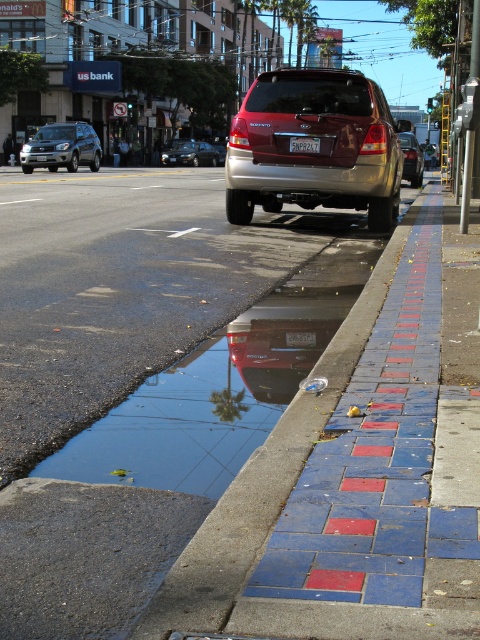
Consider the image. You are standing at the point marked by the coordinates point (191, 154). Looking towards the parked maroon Kia Sorento, which direction should you walk to reach it?

The metallic silver sedan at center is represented by point (191, 154). The parked maroon Kia Sorento is located along the curb in the foreground. To reach the parked maroon Kia Sorento from the point, you should walk towards the curb, which is likely in the forward direction from your current position.

You are a pedestrian standing on the sidewalk and see the silver metallic suv at left and the white plastic license plate at center. Which object is closer to you?

The silver metallic suv at left is closer to you because the white plastic license plate at center is behind it.

You are a pedestrian standing on the sidewalk and want to cross the road. Which vehicle, the metallic silver sedan at center or the metallic silver suv at center, is closer to you as you look towards the road?

The metallic silver sedan at center is closer to you because it is positioned further to the viewer than the metallic silver suv at center.